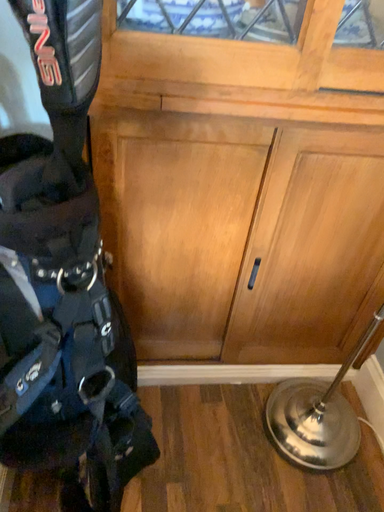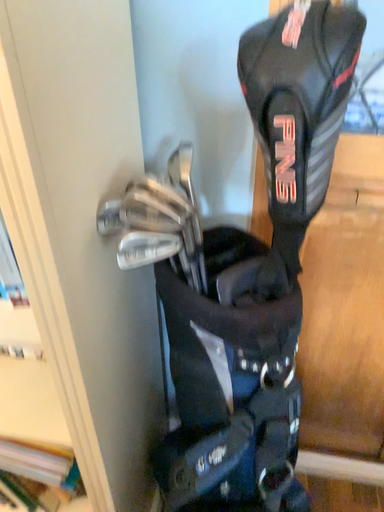
Question: Which way did the camera rotate in the video?

Choices:
 (A) rotated upward
 (B) rotated downward

Answer: (A)